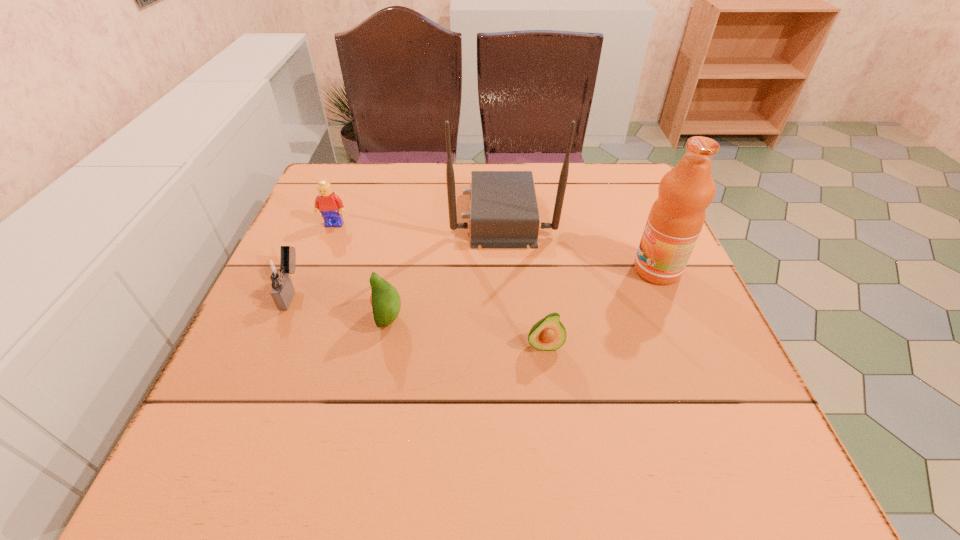
The height and width of the screenshot is (540, 960). Identify the location of the left avocado. (386, 303).

Where is `the third object from left to right`? the third object from left to right is located at coordinates (386, 303).

This screenshot has width=960, height=540. What are the coordinates of `the nearer avocado` in the screenshot? It's located at (548, 334).

Locate an element on the screen. The height and width of the screenshot is (540, 960). the shorter avocado is located at coordinates (548, 334).

Image resolution: width=960 pixels, height=540 pixels. I want to click on fruit juice, so click(x=676, y=218).

Where is `Lego`? Lego is located at coordinates (330, 205).

You are a GUI agent. You are given a task and a screenshot of the screen. Output one action in this format:
    pyautogui.click(x=<x>, y=<y>)
    Task: Click on the router
    This screenshot has height=540, width=960.
    Given the screenshot: What is the action you would take?
    pyautogui.click(x=504, y=214)

What are the coordinates of `igniter` in the screenshot? It's located at (278, 271).

What are the coordinates of `free space located 0.050m on the cut side of the farther avocado` in the screenshot? It's located at [x=349, y=319].

I want to click on vacant space situated 0.070m on the cut side of the farther avocado, so click(340, 319).